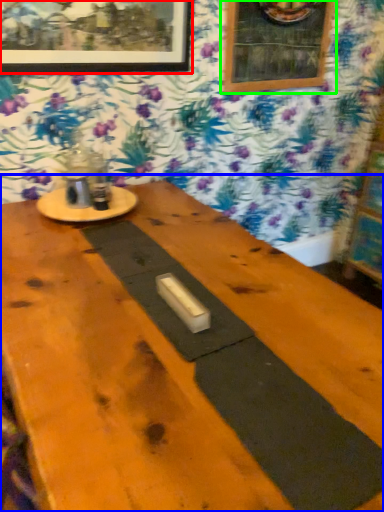
Question: Which object is positioned closest to picture frame (highlighted by a red box)? Select from table (highlighted by a blue box) and picture frame (highlighted by a green box).

Choices:
 (A) table
 (B) picture frame

Answer: (B)